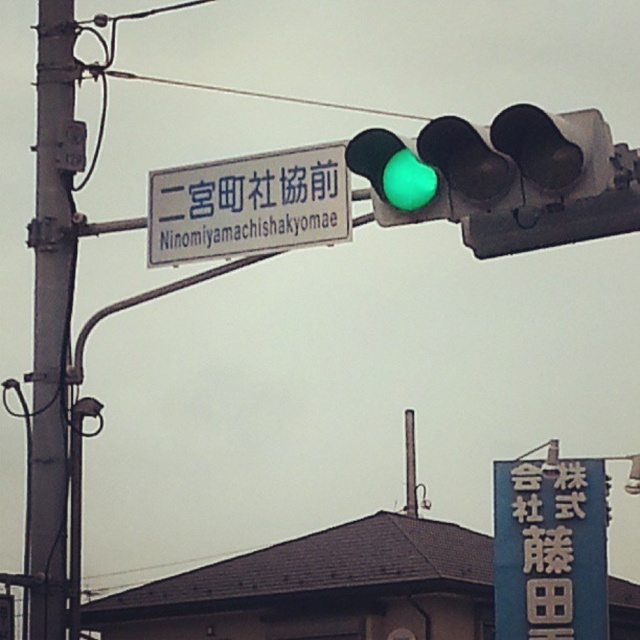
Question: Can you confirm if blue plastic sign at lower right is positioned above white plastic sign at upper center?

Choices:
 (A) yes
 (B) no

Answer: (B)

Question: Does blue plastic sign at lower right have a smaller size compared to metallic wire at upper center?

Choices:
 (A) yes
 (B) no

Answer: (A)

Question: Among these points, which one is nearest to the camera?

Choices:
 (A) (324, 240)
 (B) (604, 540)
 (C) (396, 116)

Answer: (A)

Question: Which object appears farthest from the camera in this image?

Choices:
 (A) blue plastic sign at lower right
 (B) rusty metal telegraph pole at left
 (C) green glass traffic light at upper center

Answer: (A)

Question: Is the position of rusty metal telegraph pole at left more distant than that of metallic wire at upper center?

Choices:
 (A) no
 (B) yes

Answer: (A)

Question: Which object is closer to the camera taking this photo?

Choices:
 (A) blue plastic sign at lower right
 (B) green glass traffic light at upper center

Answer: (B)